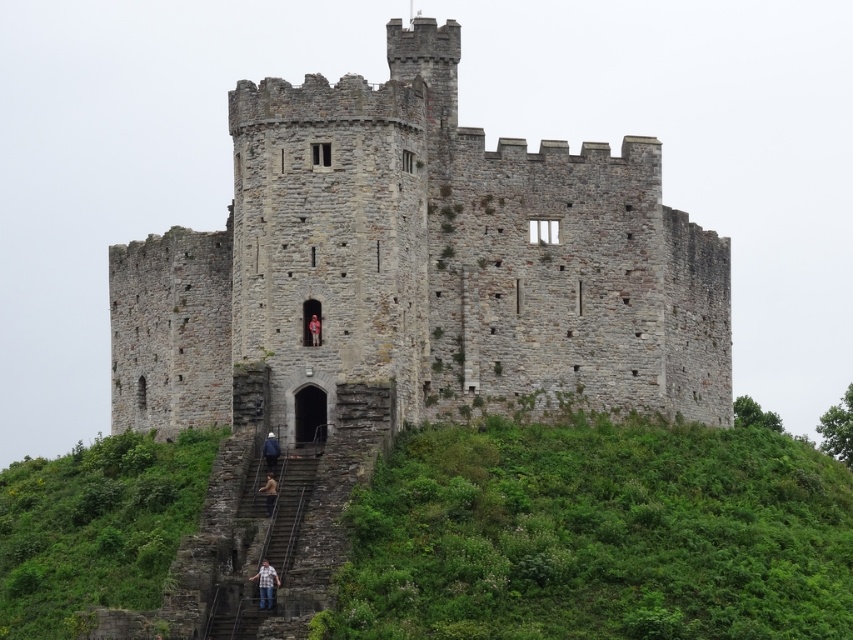
Question: Which of the following is the farthest from the observer?

Choices:
 (A) red fabric person at center
 (B) dark blue jeans at lower center

Answer: (A)

Question: Observing the image, what is the correct spatial positioning of jeans at lower center in reference to dark blue jeans at lower center?

Choices:
 (A) left
 (B) right

Answer: (B)

Question: Which point is closer to the camera?

Choices:
 (A) (260, 486)
 (B) (315, 316)
 (C) (270, 456)
 (D) (447, 216)

Answer: (A)

Question: Does gray stone castle at center appear on the left side of jeans at lower center?

Choices:
 (A) yes
 (B) no

Answer: (B)

Question: Is jeans at lower center below red fabric person at center?

Choices:
 (A) yes
 (B) no

Answer: (A)

Question: Among these objects, which one is nearest to the camera?

Choices:
 (A) blue denim jeans at lower center
 (B) jeans at lower center
 (C) gray stone castle at center
 (D) red fabric person at center

Answer: (B)